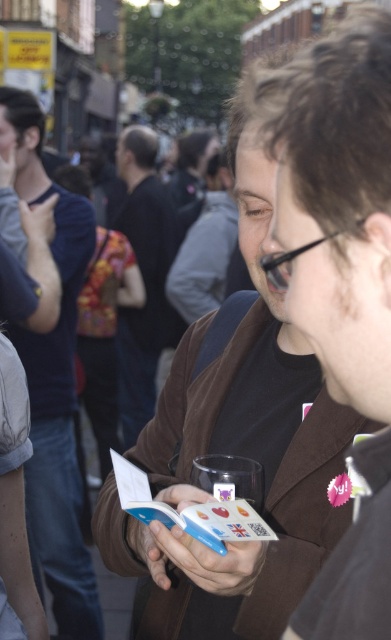
Question: In this image, where is dark brown leather jacket at center located relative to floral fabric purse at center?

Choices:
 (A) above
 (B) below

Answer: (A)

Question: Does matte brown jacket at left have a larger size compared to floral fabric purse at center?

Choices:
 (A) yes
 (B) no

Answer: (B)

Question: Which point is closer to the camera?

Choices:
 (A) (123, 168)
 (B) (132, 296)
 (C) (30, 465)

Answer: (C)

Question: Which point is farther to the camera?

Choices:
 (A) floral fabric purse at center
 (B) dark brown leather jacket at center
 (C) matte brown jacket at left

Answer: (B)

Question: Which point is farther from the camera taking this photo?

Choices:
 (A) (114, 364)
 (B) (152, 225)

Answer: (B)

Question: Is matte brown jacket at left thinner than dark brown leather jacket at center?

Choices:
 (A) no
 (B) yes

Answer: (B)